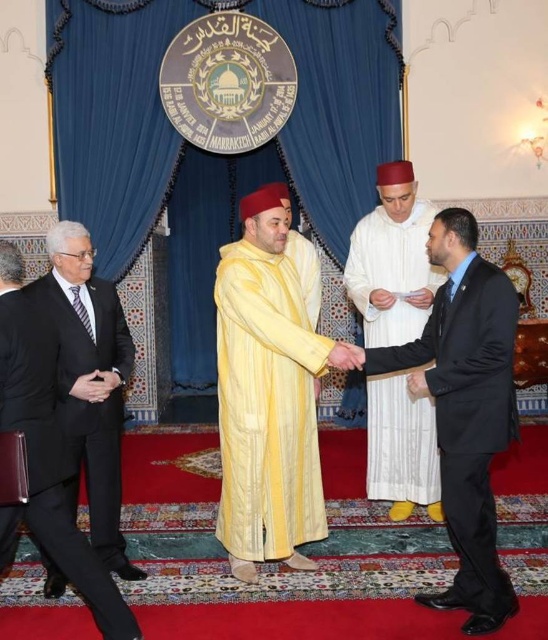
Question: Considering the relative positions of black wool suit at left and black suit at left in the image provided, where is black wool suit at left located with respect to black suit at left?

Choices:
 (A) below
 (B) above

Answer: (A)

Question: Which is farther from the yellow silk robe at center?

Choices:
 (A) black wool suit at left
 (B) black suit at left
 (C) black suit at center
 (D) white textured robe at center

Answer: (B)

Question: Is yellow silk robe at center above black suit at left?

Choices:
 (A) no
 (B) yes

Answer: (B)

Question: Which point appears farthest from the camera in this image?

Choices:
 (A) (116, 307)
 (B) (28, 339)

Answer: (A)

Question: Among these points, which one is farthest from the camera?

Choices:
 (A) (59, 385)
 (B) (476, 545)

Answer: (A)

Question: Can you confirm if yellow silk robe at center is smaller than black suit at center?

Choices:
 (A) no
 (B) yes

Answer: (B)